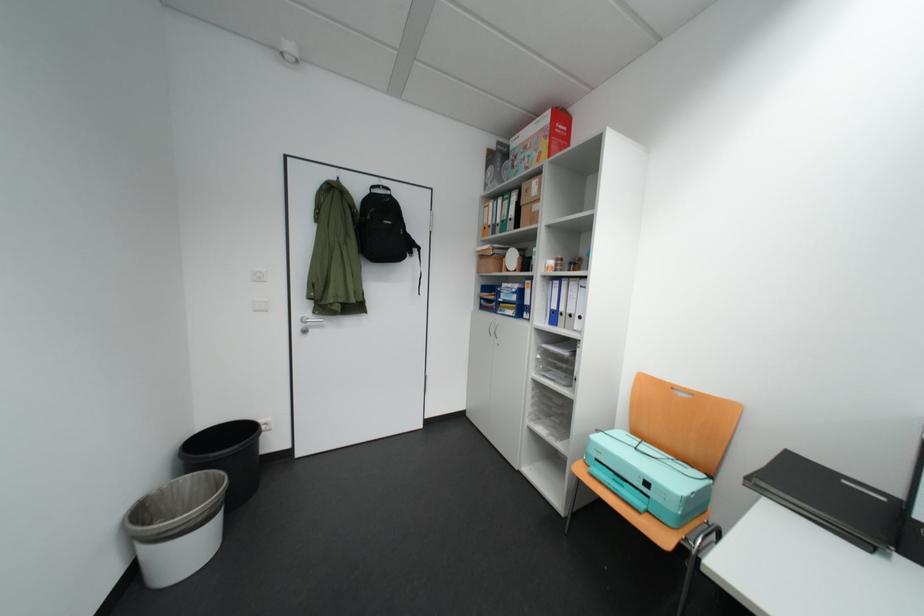
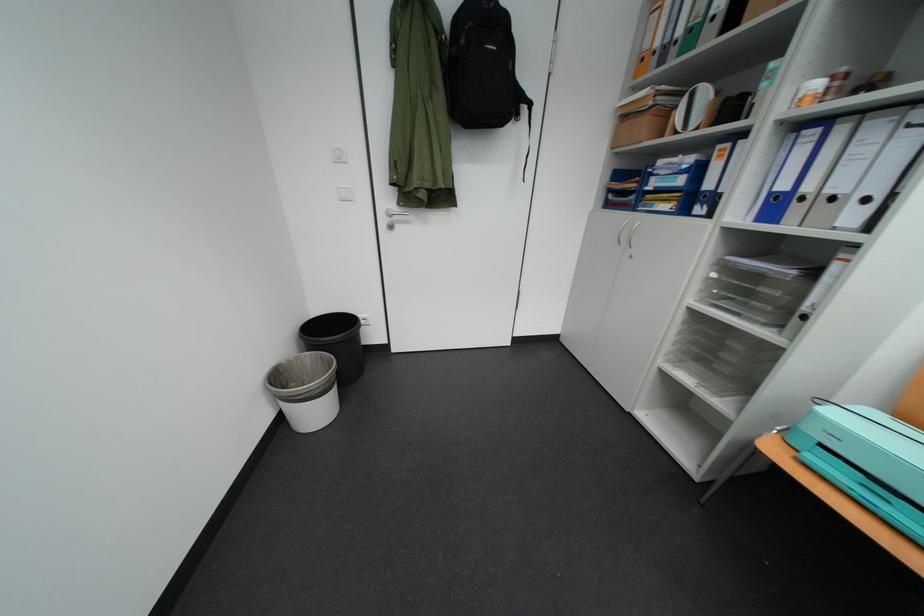
In the second image, find the point that corresponds to point 201,556 in the first image.

(329, 415)